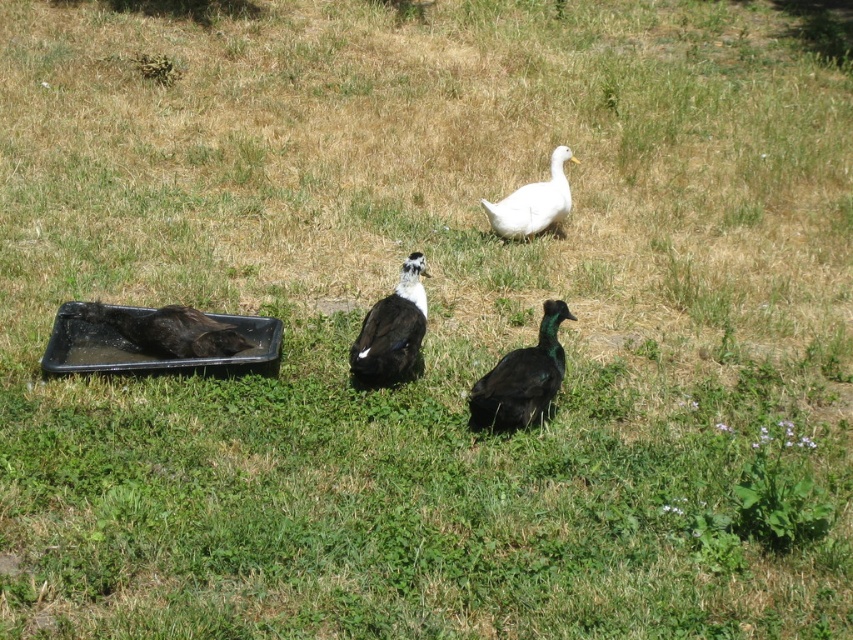
Question: Which point appears closest to the camera in this image?

Choices:
 (A) (357, 368)
 (B) (125, 337)
 (C) (527, 212)

Answer: (A)

Question: Does green glossy duck at center appear on the right side of black matte tray at left?

Choices:
 (A) yes
 (B) no

Answer: (A)

Question: Which object appears farthest from the camera in this image?

Choices:
 (A) black matte tray at left
 (B) green glossy duck at center

Answer: (A)

Question: Is green glossy duck at center thinner than white matte duck at upper center?

Choices:
 (A) yes
 (B) no

Answer: (A)

Question: Which of the following is the farthest from the observer?

Choices:
 (A) (550, 300)
 (B) (410, 296)
 (C) (155, 310)

Answer: (A)

Question: Is black matte tray at left positioned before white matte duck at upper center?

Choices:
 (A) yes
 (B) no

Answer: (A)